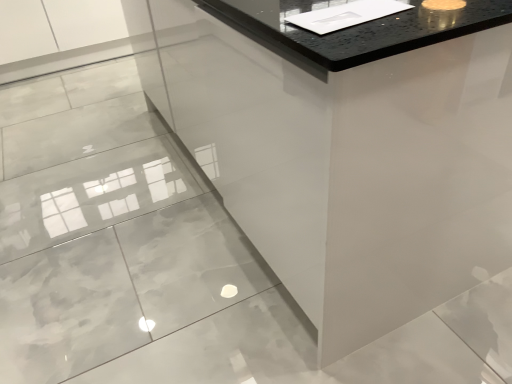
What do you see at coordinates (350, 148) in the screenshot? This screenshot has height=384, width=512. I see `white glossy vanity at center` at bounding box center [350, 148].

At what (x,y) coordinates should I click in order to perform the action: click on white glossy vanity at center. Please return your answer as a coordinate pair (x, y). The height and width of the screenshot is (384, 512). Looking at the image, I should click on (350, 148).

You are a GUI agent. You are given a task and a screenshot of the screen. Output one action in this format:
    pyautogui.click(x=<x>, y=<y>)
    Task: Click on the white glossy vanity at center
    
    Given the screenshot: What is the action you would take?
    (x=350, y=148)